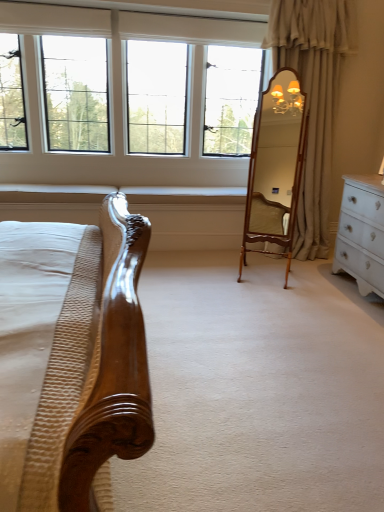
Question: Is beige fabric curtain at right completely or partially inside clear glass windows at upper center?

Choices:
 (A) yes
 (B) no

Answer: (B)

Question: From the image's perspective, does clear glass windows at upper center appear higher than beige fabric curtain at right?

Choices:
 (A) no
 (B) yes

Answer: (B)

Question: Is clear glass windows at upper center taller than beige fabric curtain at right?

Choices:
 (A) yes
 (B) no

Answer: (B)

Question: Is clear glass windows at upper center further to the viewer compared to beige fabric curtain at right?

Choices:
 (A) no
 (B) yes

Answer: (B)

Question: Is the surface of clear glass windows at upper center in direct contact with beige fabric curtain at right?

Choices:
 (A) yes
 (B) no

Answer: (B)

Question: Is point (14, 5) closer or farther from the camera than point (304, 65)?

Choices:
 (A) closer
 (B) farther

Answer: (A)

Question: In the image, is clear glass windows at upper center on the left side or the right side of beige fabric curtain at right?

Choices:
 (A) right
 (B) left

Answer: (B)

Question: Considering the positions of clear glass windows at upper center and beige fabric curtain at right in the image, is clear glass windows at upper center taller or shorter than beige fabric curtain at right?

Choices:
 (A) tall
 (B) short

Answer: (B)

Question: From the image's perspective, relative to beige fabric curtain at right, is clear glass windows at upper center above or below?

Choices:
 (A) below
 (B) above

Answer: (B)

Question: From the image's perspective, relative to beige fabric curtain at right, is wooden mirror at center above or below?

Choices:
 (A) above
 (B) below

Answer: (B)

Question: From a real-world perspective, is wooden mirror at center physically located above or below beige fabric curtain at right?

Choices:
 (A) above
 (B) below

Answer: (B)

Question: Is wooden mirror at center inside the boundaries of beige fabric curtain at right, or outside?

Choices:
 (A) outside
 (B) inside

Answer: (A)

Question: Is wooden mirror at center wider or thinner than beige fabric curtain at right?

Choices:
 (A) thin
 (B) wide

Answer: (A)

Question: Is beige fabric curtain at right taller or shorter than wooden mirror at center?

Choices:
 (A) short
 (B) tall

Answer: (B)

Question: Is point (284, 31) closer or farther from the camera than point (241, 240)?

Choices:
 (A) farther
 (B) closer

Answer: (B)